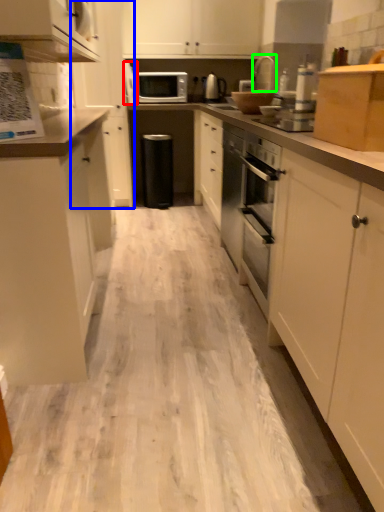
Question: Which object is positioned closest to appliance (highlighted by a red box)? Select from cabinetry (highlighted by a blue box) and appliance (highlighted by a green box).

Choices:
 (A) cabinetry
 (B) appliance

Answer: (A)